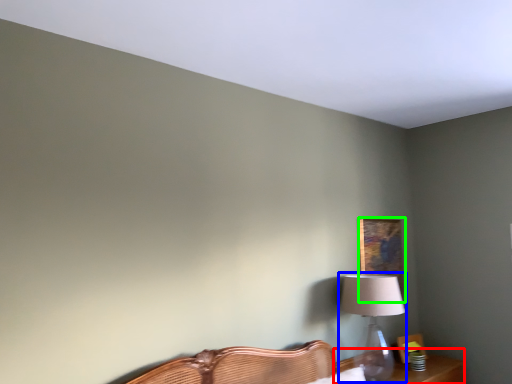
Question: Which object is the farthest from table (highlighted by a red box)? Choose among these: table lamp (highlighted by a blue box) or picture frame (highlighted by a green box).

Choices:
 (A) table lamp
 (B) picture frame

Answer: (B)